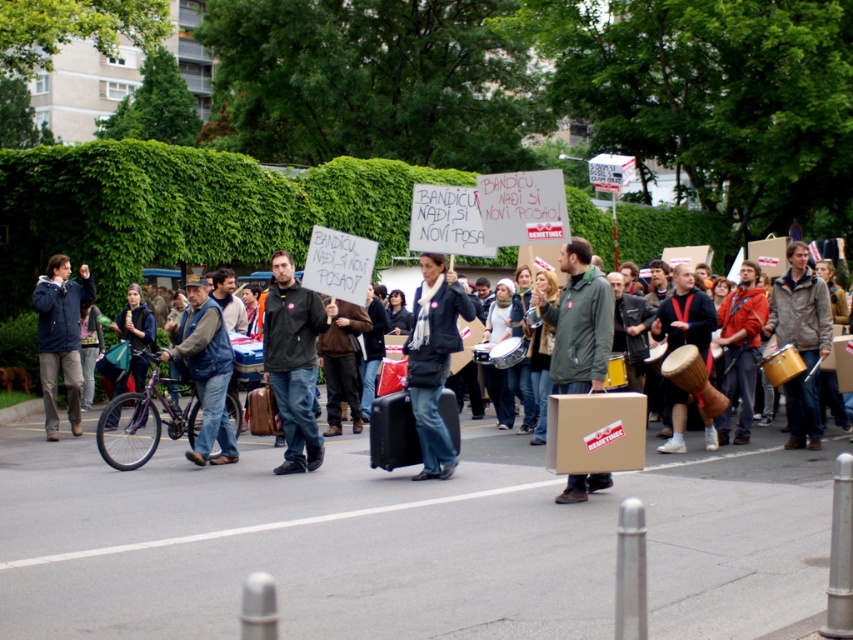
You are a photographer trying to capture the protest scene. You want to position your camera so that the matte black jacket at center is exactly in the center of your photo. What coordinates should you aim for?

The coordinates for the matte black jacket at center are at point (293, 362), so you should aim your camera to center the photo at those coordinates.

In the scene shown: You are a photographer standing at the edge of the protest crowd. You want to take a photo of the dark blue jacket at center. Where should you aim your camera to capture it?

You should aim your camera at point 0.566 on the horizontal axis and 0.509 on the vertical axis to capture the dark blue jacket at center.

You are a photographer trying to capture a photo of the golden drum at center and the matte blue jacket at left. Based on their positions, which object should you focus on first if you want to frame them both in a single shot without moving the camera?

The golden drum at center is positioned on the right side of matte blue jacket at left, so you should focus on the matte blue jacket at left first to ensure both objects are within the frame.